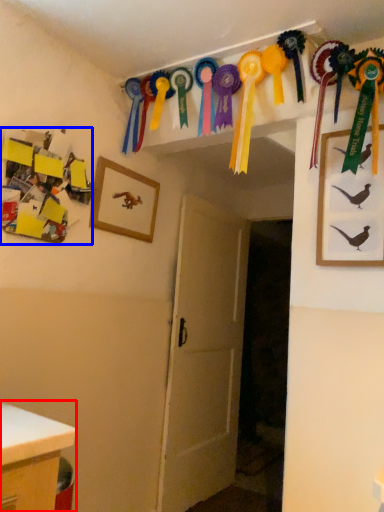
Question: Which object is further to the camera taking this photo, desk (highlighted by a red box) or art (highlighted by a blue box)?

Choices:
 (A) desk
 (B) art

Answer: (B)